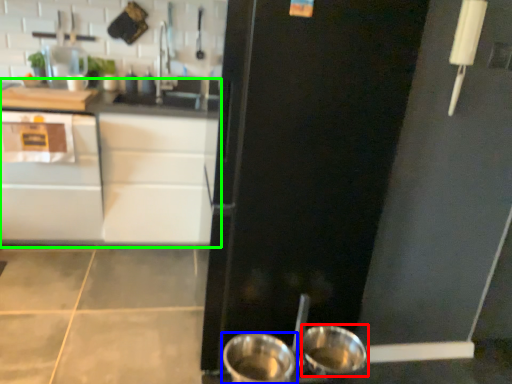
Question: Considering the real-world distances, which object is farthest from basin (highlighted by a red box)? kitchen appliance (highlighted by a blue box) or counter (highlighted by a green box)?

Choices:
 (A) kitchen appliance
 (B) counter

Answer: (B)